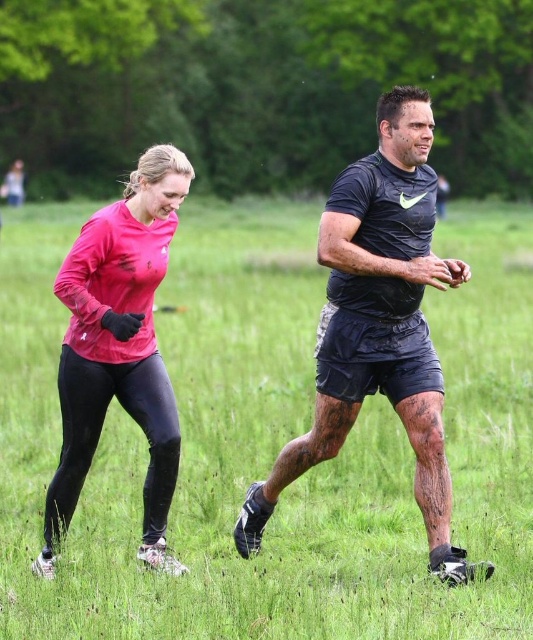
Question: Which of the following is the farthest from the observer?

Choices:
 (A) (262, 349)
 (B) (453, 556)

Answer: (A)

Question: Is black matte shirt at center further to camera compared to matte pink long-sleeve shirt at left?

Choices:
 (A) yes
 (B) no

Answer: (A)

Question: Which point is farther from the camera taking this photo?

Choices:
 (A) (68, 385)
 (B) (324, 321)

Answer: (B)

Question: Is black matte shirt at center bigger than matte pink long-sleeve shirt at left?

Choices:
 (A) no
 (B) yes

Answer: (B)

Question: Which point is closer to the camera?

Choices:
 (A) pink fabric leggings at left
 (B) matte pink long-sleeve shirt at left

Answer: (A)

Question: Does pink fabric leggings at left have a smaller size compared to black matte shirt at center?

Choices:
 (A) no
 (B) yes

Answer: (A)